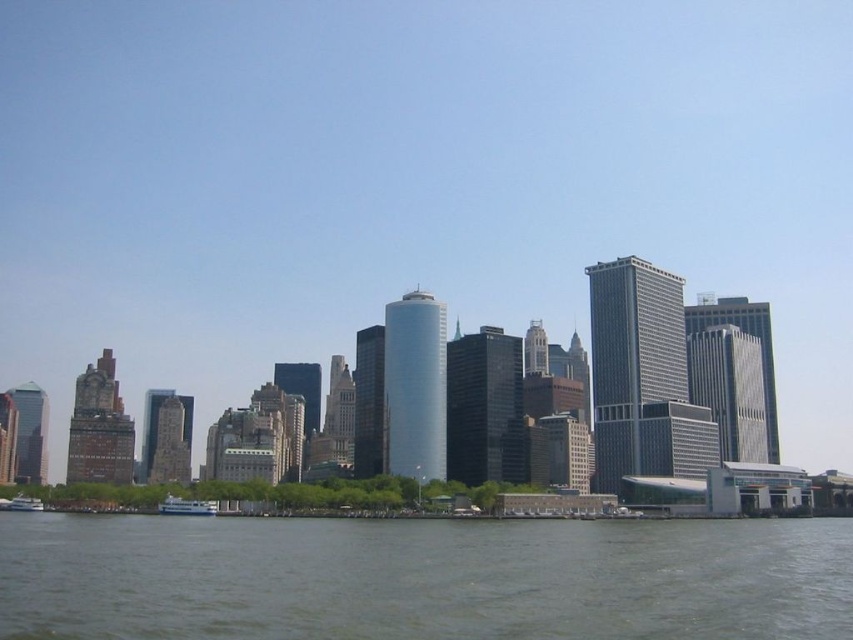
Question: Does white glossy ferry at lower center come in front of white glossy boat at lower left?

Choices:
 (A) yes
 (B) no

Answer: (A)

Question: Which object is the closest to the gray water at lower center?

Choices:
 (A) white glossy ferry at lower center
 (B) white glossy boat at lower left

Answer: (A)

Question: Can you confirm if gray water at lower center is positioned to the left of white glossy ferry at lower center?

Choices:
 (A) yes
 (B) no

Answer: (B)

Question: Estimate the real-world distances between objects in this image. Which object is farther from the white glossy ferry at lower center?

Choices:
 (A) white glossy boat at lower left
 (B) gray water at lower center

Answer: (B)

Question: Can you confirm if gray water at lower center is positioned above white glossy boat at lower left?

Choices:
 (A) yes
 (B) no

Answer: (A)

Question: Which point appears farthest from the camera in this image?

Choices:
 (A) (30, 509)
 (B) (189, 513)
 (C) (590, 572)

Answer: (A)